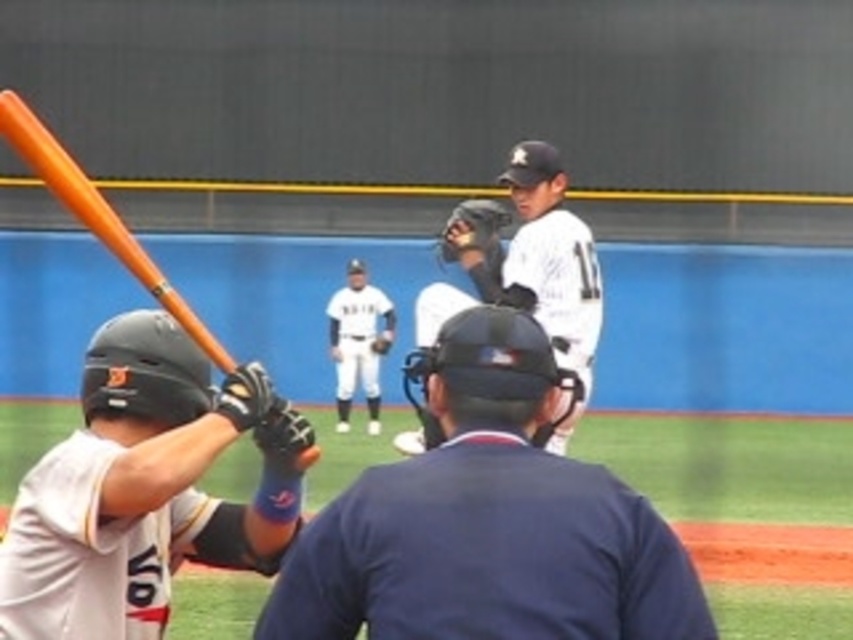
You are a photographer standing at the edge of the baseball field. You want to take a photo that includes both the dark blue textured shirt at center and the matte black helmet at lower left. Which object should you zoom in on to ensure both are fully visible in the frame?

The dark blue textured shirt at center is wider than the matte black helmet at lower left. To ensure both are fully visible, you should zoom in on the matte black helmet at lower left since it is narrower and requires less space in the frame.

You are a player standing at the point marked as point (x=57, y=154). You need to throw a ball to the point marked as point (x=469, y=244). Which direction should you throw the ball to ensure it reaches the target?

Point (x=57, y=154) is in front of point (x=469, y=244), so you should throw the ball backward to reach the target.

You are a coach observing the baseball game. You see the orange matte baseball bat at left and the black leather baseball glove at center. Which object is located more to the left side of the field?

The orange matte baseball bat at left is positioned on the left side of the black leather baseball glove at center, so it is more to the left side of the field.